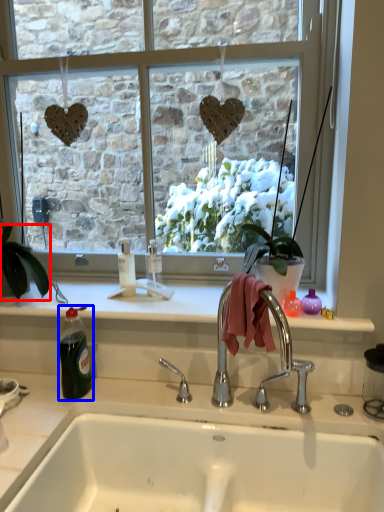
Question: Which point is further to the camera, houseplant (highlighted by a red box) or bottle (highlighted by a blue box)?

Choices:
 (A) houseplant
 (B) bottle

Answer: (A)